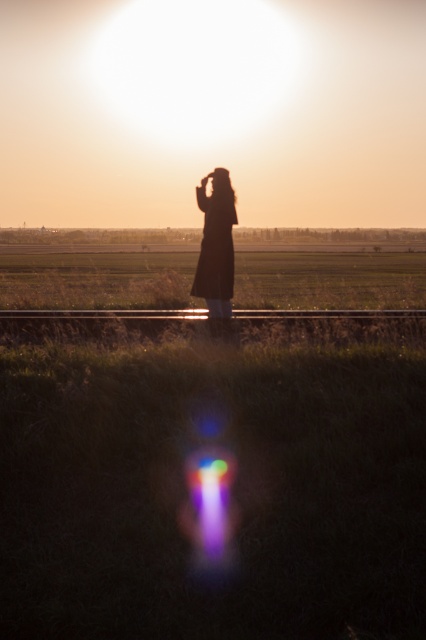
Looking at this image, who is taller, silhouette coat at center or metallic train track at center?

With more height is silhouette coat at center.

Can you confirm if silhouette coat at center is bigger than metallic train track at center?

Yes.

Measure the distance between silhouette coat at center and camera.

A distance of 26.31 feet exists between silhouette coat at center and camera.

In order to click on silhouette coat at center in this screenshot , I will do point(215,244).